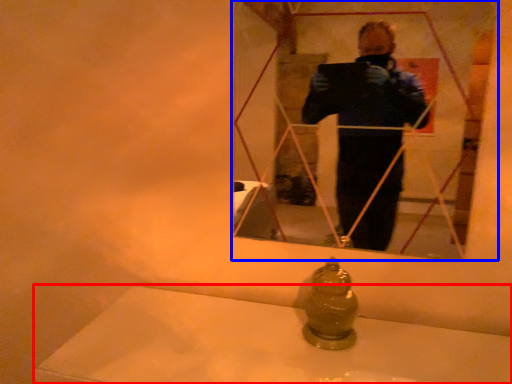
Question: Which object appears farthest to the camera in this image, bath (highlighted by a red box) or mirror (highlighted by a blue box)?

Choices:
 (A) bath
 (B) mirror

Answer: (B)